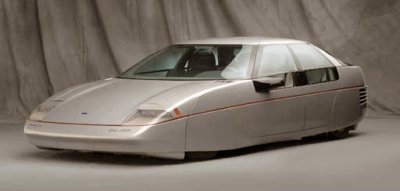
Identify the location of floor. (297, 172).